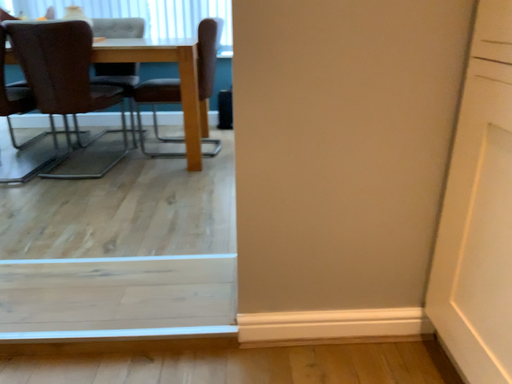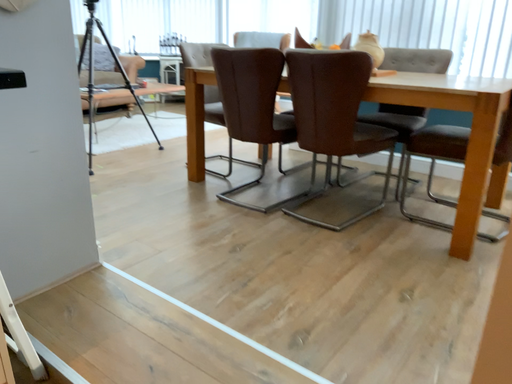
Question: How did the camera likely rotate when shooting the video?

Choices:
 (A) rotated left
 (B) rotated right

Answer: (A)